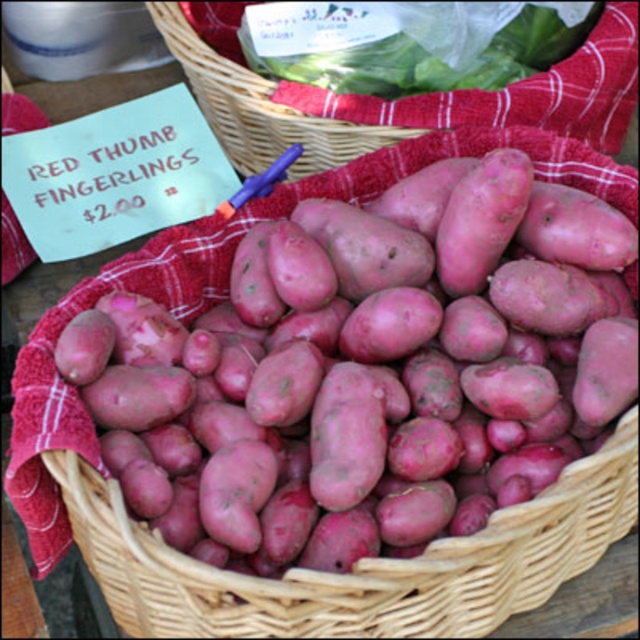
Which of these two, matte red potato at center or smooth green leafy vegetable at upper center, stands shorter?

Standing shorter between the two is smooth green leafy vegetable at upper center.

Who is positioned more to the right, matte red potato at center or smooth green leafy vegetable at upper center?

From the viewer's perspective, smooth green leafy vegetable at upper center appears more on the right side.

Describe the element at coordinates (356, 356) in the screenshot. The height and width of the screenshot is (640, 640). I see `matte red potato at center` at that location.

Where is `matte red potato at center`? The height and width of the screenshot is (640, 640). matte red potato at center is located at coordinates (356, 356).

Can you confirm if matte red potato at center is positioned to the left of matte wicker basket at center?

Indeed, matte red potato at center is positioned on the left side of matte wicker basket at center.

Does point (291, 349) come farther from viewer compared to point (636, 17)?

No, (291, 349) is in front of (636, 17).

Find the location of `matte red potato at center`. matte red potato at center is located at coordinates (356, 356).

Is matte wicker basket at center positioned in front of smooth green leafy vegetable at upper center?

No, matte wicker basket at center is behind smooth green leafy vegetable at upper center.

Who is taller, matte wicker basket at center or smooth green leafy vegetable at upper center?

With more height is matte wicker basket at center.

Is point (580, 77) positioned before point (451, 28)?

That is False.

Where is `matte wicker basket at center`? The width and height of the screenshot is (640, 640). matte wicker basket at center is located at coordinates (392, 100).